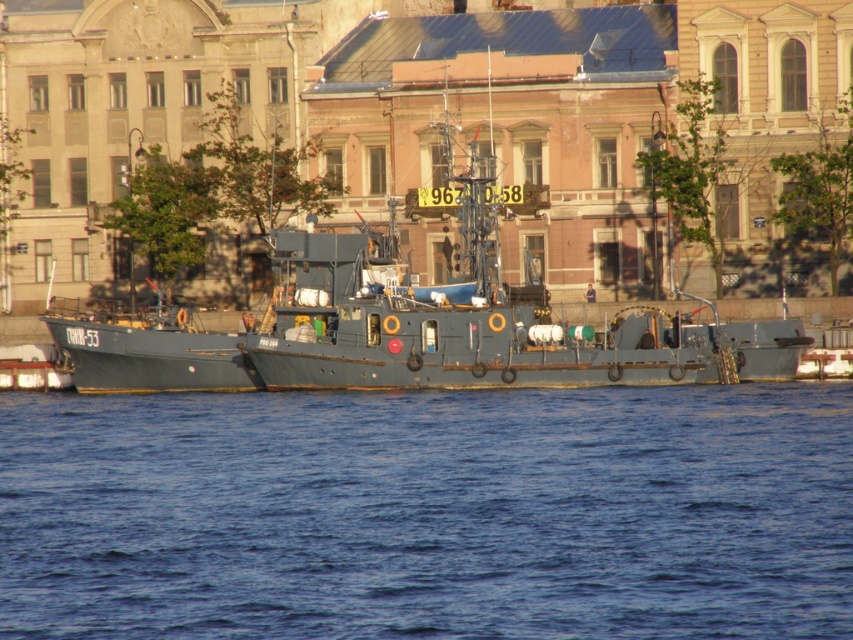
You are standing on the shore and looking at the blue water at center and the matte gray boat at center. Which object is nearer to you?

The blue water at center is closer to the viewer than the matte gray boat at center.

You are standing on the ship and looking towards the point marked by coordinates point (428, 513). What do you see in that direction?

The point (428, 513) marks blue water at center, so you see blue water at center in that direction.